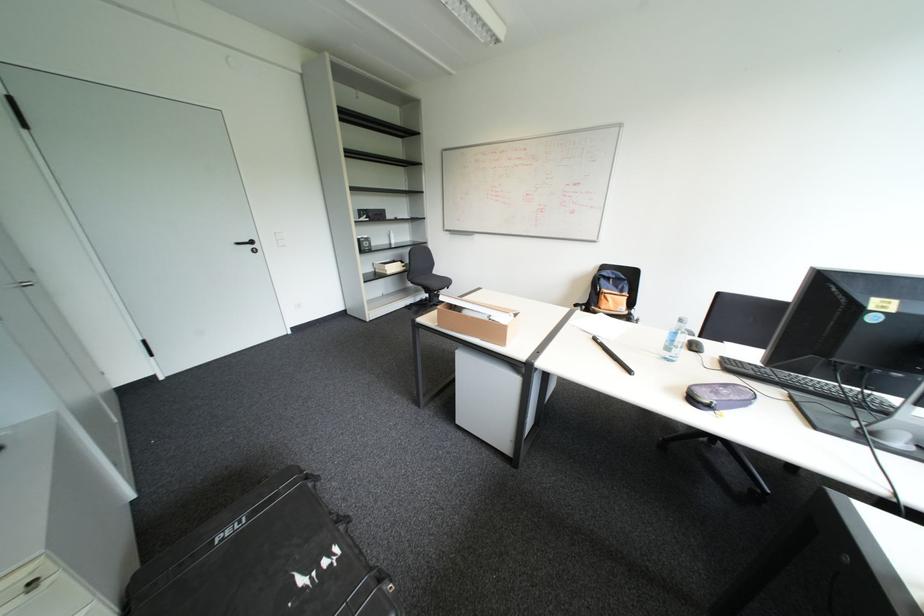
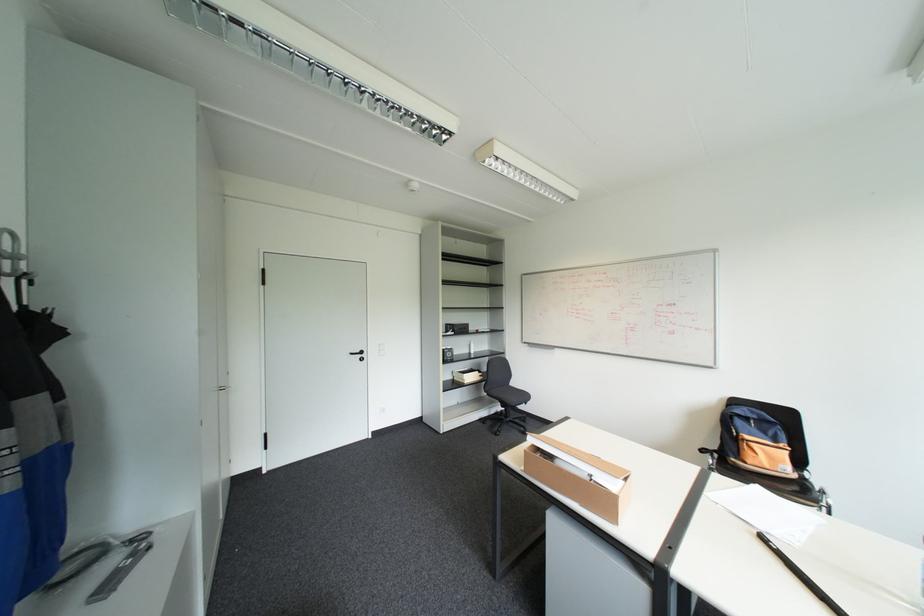
Where in the second image is the point corresponding to point (472, 307) from the first image?

(565, 455)